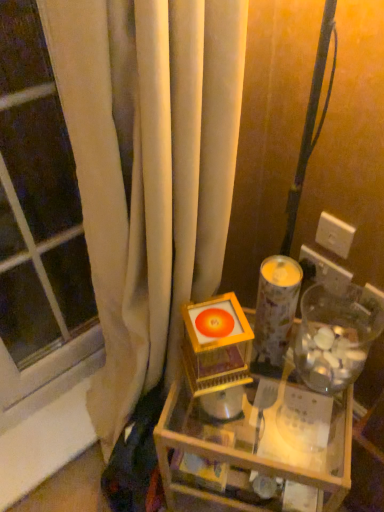
Question: Does patterned paper candle holder at center have a lesser height compared to wooden table at center?

Choices:
 (A) no
 (B) yes

Answer: (B)

Question: Is patterned paper candle holder at center aimed at wooden table at center?

Choices:
 (A) yes
 (B) no

Answer: (B)

Question: Is patterned paper candle holder at center to the left of wooden table at center from the viewer's perspective?

Choices:
 (A) no
 (B) yes

Answer: (A)

Question: Does patterned paper candle holder at center have a smaller size compared to wooden table at center?

Choices:
 (A) no
 (B) yes

Answer: (B)

Question: Is patterned paper candle holder at center wider than wooden table at center?

Choices:
 (A) no
 (B) yes

Answer: (A)

Question: Considering the relative positions of orange glossy disc at center and wooden table at center in the image provided, is orange glossy disc at center to the left or to the right of wooden table at center?

Choices:
 (A) right
 (B) left

Answer: (B)

Question: Is orange glossy disc at center taller or shorter than wooden table at center?

Choices:
 (A) tall
 (B) short

Answer: (B)

Question: Considering the positions of point (196, 324) and point (258, 458), is point (196, 324) closer or farther from the camera than point (258, 458)?

Choices:
 (A) farther
 (B) closer

Answer: (A)

Question: From the image's perspective, is orange glossy disc at center located above or below wooden table at center?

Choices:
 (A) above
 (B) below

Answer: (A)

Question: Relative to transparent glass window at left, is transparent plastic jar at right in front or behind?

Choices:
 (A) behind
 (B) front

Answer: (A)

Question: Is transparent plastic jar at right wider or thinner than transparent glass window at left?

Choices:
 (A) wide
 (B) thin

Answer: (A)

Question: In terms of size, does transparent plastic jar at right appear bigger or smaller than transparent glass window at left?

Choices:
 (A) big
 (B) small

Answer: (B)

Question: Considering the positions of point (334, 302) and point (18, 275), is point (334, 302) closer or farther from the camera than point (18, 275)?

Choices:
 (A) closer
 (B) farther

Answer: (A)

Question: From the image's perspective, is patterned paper candle holder at center above or below wooden table at center?

Choices:
 (A) above
 (B) below

Answer: (A)

Question: From a real-world perspective, is patterned paper candle holder at center positioned above or below wooden table at center?

Choices:
 (A) below
 (B) above

Answer: (B)